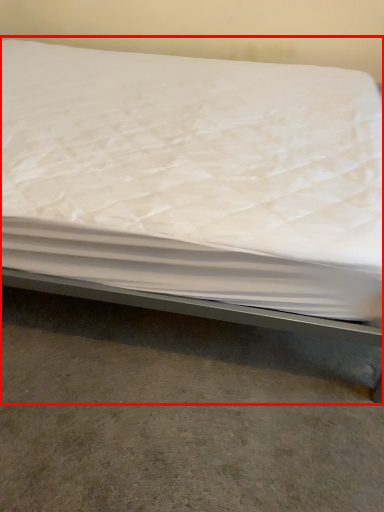
Question: From the image's perspective, considering the relative positions of bed (annotated by the red box) and concrete in the image provided, where is bed (annotated by the red box) located with respect to the staircase?

Choices:
 (A) below
 (B) above

Answer: (B)